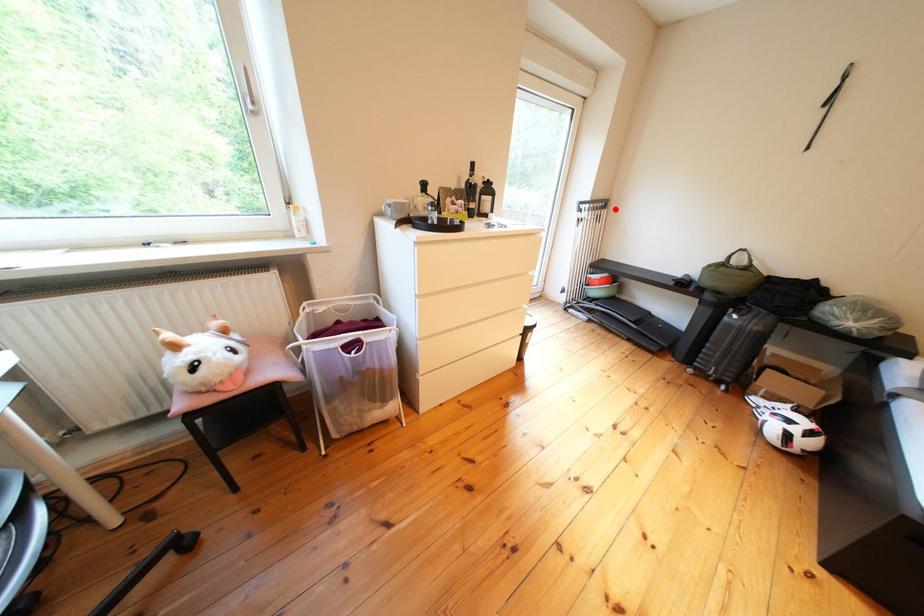
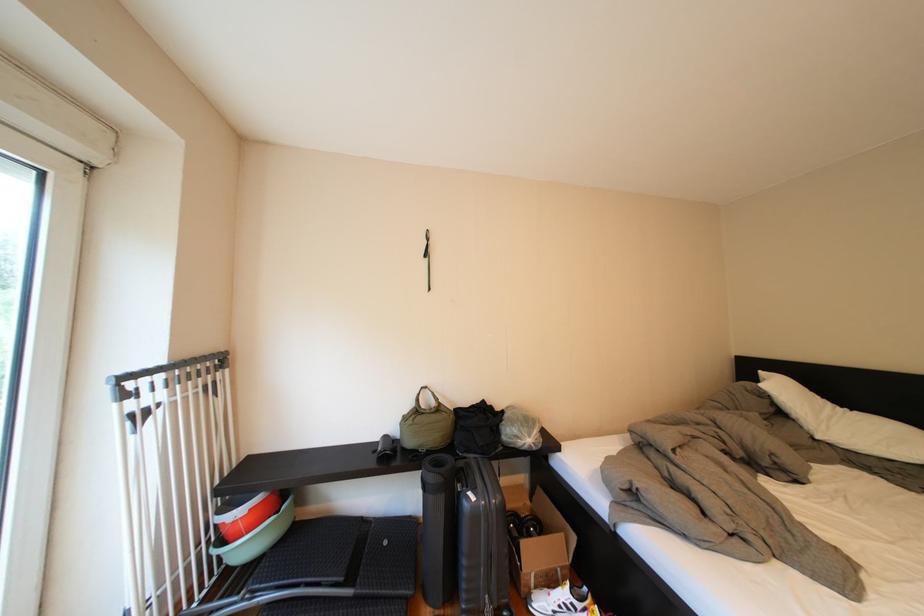
Question: A red point is marked in image1. In image2, is the corresponding 3D point closer to the camera or farther? Reply with the corresponding letter.

Choices:
 (A) The corresponding 3D point is closer.
 (B) The corresponding 3D point is farther.

Answer: (B)